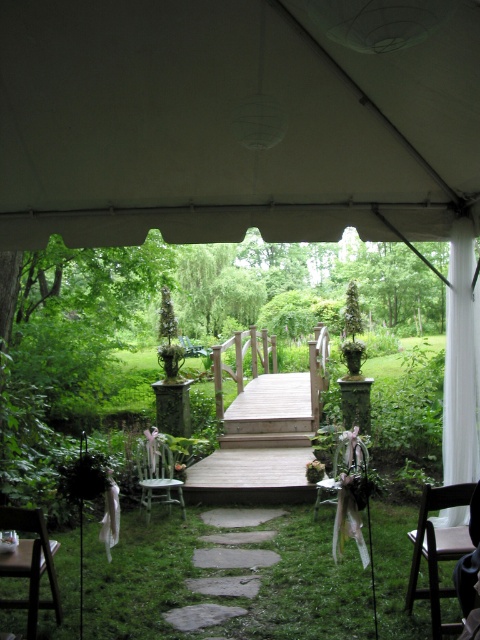
Question: Is brown wooden chair at lower right to the left of brown wooden chair at lower left from the viewer's perspective?

Choices:
 (A) yes
 (B) no

Answer: (B)

Question: Which point is closer to the camera taking this photo?

Choices:
 (A) (440, 109)
 (B) (34, 618)

Answer: (B)

Question: From the image, what is the correct spatial relationship of brown wooden chair at lower right in relation to light green painted wood chair at center?

Choices:
 (A) left
 (B) right

Answer: (B)

Question: Is brown wooden chair at lower right bigger than wooden chair at center?

Choices:
 (A) yes
 (B) no

Answer: (B)

Question: Which point appears closest to the camera in this image?

Choices:
 (A) (x=254, y=589)
 (B) (x=288, y=115)
 (C) (x=289, y=460)
 (D) (x=56, y=593)

Answer: (D)

Question: Which is farther from the light green painted wood chair at center?

Choices:
 (A) gray stone path at center
 (B) wooden bridge at center

Answer: (B)